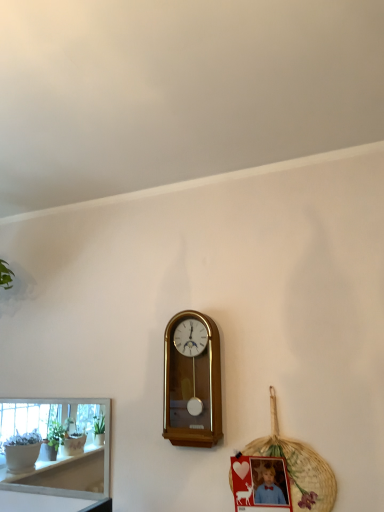
Question: Looking at their shapes, would you say white glossy shelf at lower left is wider or thinner than matte plastic picture frame at lower right?

Choices:
 (A) wide
 (B) thin

Answer: (B)

Question: Choose the correct answer: Is white glossy shelf at lower left inside matte plastic picture frame at lower right or outside it?

Choices:
 (A) inside
 (B) outside

Answer: (B)

Question: Estimate the real-world distances between objects in this image. Which object is closer to the woven straw basket at lower right?

Choices:
 (A) white glossy shelf at lower left
 (B) wooden wall clock at center
 (C) matte plastic picture frame at lower right

Answer: (C)

Question: Estimate the real-world distances between objects in this image. Which object is closer to the woven straw basket at lower right?

Choices:
 (A) white glossy shelf at lower left
 (B) matte plastic picture frame at lower right
 (C) wooden wall clock at center

Answer: (B)